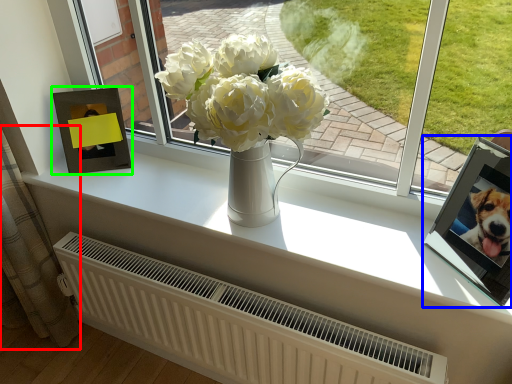
Question: Which object is the closest to the curtain (highlighted by a red box)? Choose among these: picture frame (highlighted by a blue box) or picture frame (highlighted by a green box).

Choices:
 (A) picture frame
 (B) picture frame

Answer: (B)